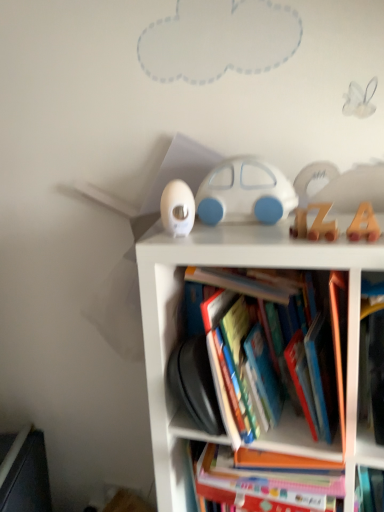
What do you see at coordinates (322, 375) in the screenshot? Image resolution: width=384 pixels, height=512 pixels. I see `hardcover book at center` at bounding box center [322, 375].

This screenshot has width=384, height=512. What do you see at coordinates (314, 224) in the screenshot?
I see `wooden letter at upper center, the 2th toy when ordered from front to back` at bounding box center [314, 224].

You are a GUI agent. You are given a task and a screenshot of the screen. Output one action in this format:
    pyautogui.click(x=<x>, y=<y>)
    Task: Click on the wooden letter at upper center, the 2th toy when ordered from front to back
    
    Given the screenshot: What is the action you would take?
    pyautogui.click(x=314, y=224)

Where is `white matte car at center, positioned as the first toy in back-to-front order`? This screenshot has width=384, height=512. white matte car at center, positioned as the first toy in back-to-front order is located at coordinates (245, 193).

You are a GUI agent. You are given a task and a screenshot of the screen. Output one action in this format:
    pyautogui.click(x=<x>, y=<y>)
    Task: Click on the wooden letter a at upper right, placed as the 4th toy when sorted from back to front
    
    Given the screenshot: What is the action you would take?
    pyautogui.click(x=364, y=224)

Does wooden letter a at upper right, placed as the 4th toy when sorted from back to front, turn towards wooden letter at upper center, arranged as the third toy when viewed from the back?

No.

Is point (360, 234) less distant than point (307, 237)?

Yes, it is in front of point (307, 237).

From a real-world perspective, relative to wooden letter at upper center, arranged as the third toy when viewed from the back, is wooden letter a at upper right, placed as the 4th toy when sorted from back to front, vertically above or below?

From a real-world perspective, wooden letter a at upper right, placed as the 4th toy when sorted from back to front, is physically above wooden letter at upper center, arranged as the third toy when viewed from the back.

Locate an element on the screen. Image resolution: width=384 pixels, height=512 pixels. toy below the wooden letter a at upper right, placed as the 4th toy when sorted from back to front (from a real-world perspective) is located at coordinates tap(314, 224).

Find the location of `bookcase below the white plastic thermometer at upper left, acting as the second toy starting from the back (from a real-world perspective)`. bookcase below the white plastic thermometer at upper left, acting as the second toy starting from the back (from a real-world perspective) is located at coordinates (231, 265).

Between white plastic thermometer at upper left, acting as the second toy starting from the back, and white plastic bookcase at center, which one has smaller width?

Thinner between the two is white plastic thermometer at upper left, acting as the second toy starting from the back.

Is white plastic thermometer at upper left, acting as the second toy starting from the back, touching white plastic bookcase at center?

No, white plastic thermometer at upper left, acting as the second toy starting from the back, is not making contact with white plastic bookcase at center.

Is white plastic thermometer at upper left, acting as the second toy starting from the back, oriented away from white plastic bookcase at center?

No, white plastic bookcase at center is not at the back of white plastic thermometer at upper left, acting as the second toy starting from the back.

Is the surface of white matte car at center, placed as the 4th toy when sorted from front to back, in direct contact with wooden letter at upper center, the 2th toy when ordered from front to back?

No, white matte car at center, placed as the 4th toy when sorted from front to back, is not in contact with wooden letter at upper center, the 2th toy when ordered from front to back.

From the image's perspective, is white matte car at center, placed as the 4th toy when sorted from front to back, located above or below wooden letter at upper center, arranged as the third toy when viewed from the back?

From the image's perspective, white matte car at center, placed as the 4th toy when sorted from front to back, appears above wooden letter at upper center, arranged as the third toy when viewed from the back.

Based on their positions, is white matte car at center, positioned as the first toy in back-to-front order, located to the left or right of wooden letter at upper center, the 2th toy when ordered from front to back?

white matte car at center, positioned as the first toy in back-to-front order, is to the left of wooden letter at upper center, the 2th toy when ordered from front to back.

Is point (211, 187) farther from camera compared to point (329, 226)?

That is True.

Considering the relative sizes of wooden letter at upper center, the 2th toy when ordered from front to back, and white plastic thermometer at upper left, acting as the second toy starting from the back, in the image provided, is wooden letter at upper center, the 2th toy when ordered from front to back, bigger than white plastic thermometer at upper left, acting as the second toy starting from the back,?

No, wooden letter at upper center, the 2th toy when ordered from front to back, is not bigger than white plastic thermometer at upper left, acting as the second toy starting from the back.

Is wooden letter at upper center, arranged as the third toy when viewed from the back, further to the viewer compared to white plastic thermometer at upper left, acting as the second toy starting from the back?

No, wooden letter at upper center, arranged as the third toy when viewed from the back, is closer to the camera.

Considering the sizes of objects wooden letter at upper center, arranged as the third toy when viewed from the back, and white plastic thermometer at upper left, the third toy from the front, in the image provided, who is thinner, wooden letter at upper center, arranged as the third toy when viewed from the back, or white plastic thermometer at upper left, the third toy from the front,?

wooden letter at upper center, arranged as the third toy when viewed from the back, is thinner.

Looking at the image, does hardcover book at center seem bigger or smaller compared to wooden letter a at upper right, the first toy positioned from the front?

hardcover book at center is bigger than wooden letter a at upper right, the first toy positioned from the front.

What's the angular difference between hardcover book at center and wooden letter a at upper right, placed as the 4th toy when sorted from back to front,'s facing directions?

The angular difference between hardcover book at center and wooden letter a at upper right, placed as the 4th toy when sorted from back to front, is 1.28 degrees.

Considering the sizes of hardcover book at center and wooden letter a at upper right, the first toy positioned from the front, in the image, is hardcover book at center taller or shorter than wooden letter a at upper right, the first toy positioned from the front,?

Clearly, hardcover book at center is taller compared to wooden letter a at upper right, the first toy positioned from the front.

Is hardcover book at center wider or thinner than wooden letter a at upper right, the first toy positioned from the front?

hardcover book at center is wider than wooden letter a at upper right, the first toy positioned from the front.

Is wooden letter at upper center, the 2th toy when ordered from front to back, oriented towards wooden letter a at upper right, placed as the 4th toy when sorted from back to front?

No, wooden letter at upper center, the 2th toy when ordered from front to back, does not turn towards wooden letter a at upper right, placed as the 4th toy when sorted from back to front.

Can you confirm if wooden letter at upper center, the 2th toy when ordered from front to back, is smaller than wooden letter a at upper right, placed as the 4th toy when sorted from back to front?

Incorrect, wooden letter at upper center, the 2th toy when ordered from front to back, is not smaller in size than wooden letter a at upper right, placed as the 4th toy when sorted from back to front.

Identify the location of toy located in front of the wooden letter at upper center, the 2th toy when ordered from front to back. (364, 224).

From the image's perspective, who appears lower, wooden letter at upper center, arranged as the third toy when viewed from the back, or wooden letter a at upper right, placed as the 4th toy when sorted from back to front?

wooden letter a at upper right, placed as the 4th toy when sorted from back to front, from the image's perspective.

Considering the relative sizes of wooden letter a at upper right, the first toy positioned from the front, and white plastic bookcase at center in the image provided, is wooden letter a at upper right, the first toy positioned from the front, smaller than white plastic bookcase at center?

Yes, wooden letter a at upper right, the first toy positioned from the front, is smaller than white plastic bookcase at center.

Can you confirm if wooden letter a at upper right, the first toy positioned from the front, is positioned to the right of white plastic bookcase at center?

Indeed, wooden letter a at upper right, the first toy positioned from the front, is positioned on the right side of white plastic bookcase at center.

Which is more distant, (374, 226) or (349, 452)?

The point (349, 452) is behind.

Between wooden letter a at upper right, the first toy positioned from the front, and white plastic bookcase at center, which one is positioned behind?

wooden letter a at upper right, the first toy positioned from the front, is behind.

The image size is (384, 512). I want to click on the 1st toy above when counting from the wooden letter a at upper right, placed as the 4th toy when sorted from back to front (from the image's perspective), so pyautogui.click(x=314, y=224).

Image resolution: width=384 pixels, height=512 pixels. Find the location of `toy that is the 3rd one above the white plastic bookcase at center (from a real-world perspective)`. toy that is the 3rd one above the white plastic bookcase at center (from a real-world perspective) is located at coordinates (177, 208).

Considering their positions, is white plastic bookcase at center positioned closer to wooden letter a at upper right, the first toy positioned from the front, than hardcover book at center?

Based on the image, hardcover book at center appears to be nearer to wooden letter a at upper right, the first toy positioned from the front.

Which object lies further to the anchor point wooden letter at upper center, arranged as the third toy when viewed from the back, white matte car at center, placed as the 4th toy when sorted from front to back, or wooden letter a at upper right, the first toy positioned from the front?

The object further to wooden letter at upper center, arranged as the third toy when viewed from the back, is white matte car at center, placed as the 4th toy when sorted from front to back.

Which object lies further to the anchor point white matte car at center, positioned as the first toy in back-to-front order, wooden letter a at upper right, placed as the 4th toy when sorted from back to front, or white plastic thermometer at upper left, the third toy from the front?

wooden letter a at upper right, placed as the 4th toy when sorted from back to front, is positioned further to the anchor white matte car at center, positioned as the first toy in back-to-front order.

Estimate the real-world distances between objects in this image. Which object is further from wooden letter at upper center, the 2th toy when ordered from front to back, white matte car at center, placed as the 4th toy when sorted from front to back, or white plastic thermometer at upper left, acting as the second toy starting from the back?

Among the two, white plastic thermometer at upper left, acting as the second toy starting from the back, is located further to wooden letter at upper center, the 2th toy when ordered from front to back.

Based on their spatial positions, is wooden letter a at upper right, the first toy positioned from the front, or white plastic bookcase at center further from hardcover book at center?

wooden letter a at upper right, the first toy positioned from the front, lies further to hardcover book at center than the other object.

Based on the photo, considering their positions, is white plastic thermometer at upper left, acting as the second toy starting from the back, positioned further to wooden letter a at upper right, the first toy positioned from the front, than hardcover book at center?

white plastic thermometer at upper left, acting as the second toy starting from the back.

Which object lies nearer to the anchor point white plastic thermometer at upper left, the third toy from the front, white plastic bookcase at center or white matte car at center, positioned as the first toy in back-to-front order?

Among the two, white matte car at center, positioned as the first toy in back-to-front order, is located nearer to white plastic thermometer at upper left, the third toy from the front.

Looking at the image, which one is located closer to white plastic bookcase at center, white matte car at center, positioned as the first toy in back-to-front order, or wooden letter at upper center, the 2th toy when ordered from front to back?

Based on the image, white matte car at center, positioned as the first toy in back-to-front order, appears to be nearer to white plastic bookcase at center.

At what (x,y) coordinates should I click in order to perform the action: click on paperback book located between white plastic thermometer at upper left, the third toy from the front, and wooden letter a at upper right, the first toy positioned from the front, in the left-right direction. Please return your answer as a coordinate pair (x, y). Image resolution: width=384 pixels, height=512 pixels. Looking at the image, I should click on (322, 375).

At what (x,y) coordinates should I click in order to perform the action: click on toy between wooden letter at upper center, the 2th toy when ordered from front to back, and white plastic bookcase at center, in the vertical direction. Please return your answer as a coordinate pair (x, y). Image resolution: width=384 pixels, height=512 pixels. Looking at the image, I should click on (364, 224).

Image resolution: width=384 pixels, height=512 pixels. Identify the location of toy between wooden letter at upper center, arranged as the third toy when viewed from the back, and hardcover book at center, in the vertical direction. (364, 224).

This screenshot has height=512, width=384. Identify the location of paperback book between white plastic thermometer at upper left, the third toy from the front, and white plastic bookcase at center from top to bottom. click(322, 375).